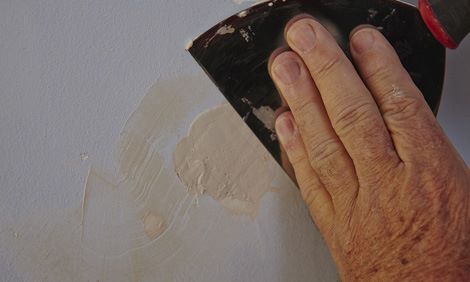
In order to click on spackle on white wall in this screenshot , I will do `click(158, 227)`, `click(242, 154)`, `click(159, 106)`, `click(85, 200)`, `click(159, 186)`, `click(154, 262)`.